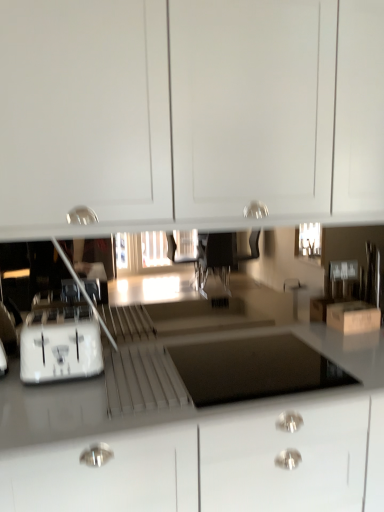
I want to click on free space in front of white plastic toaster at lower left, so click(x=47, y=403).